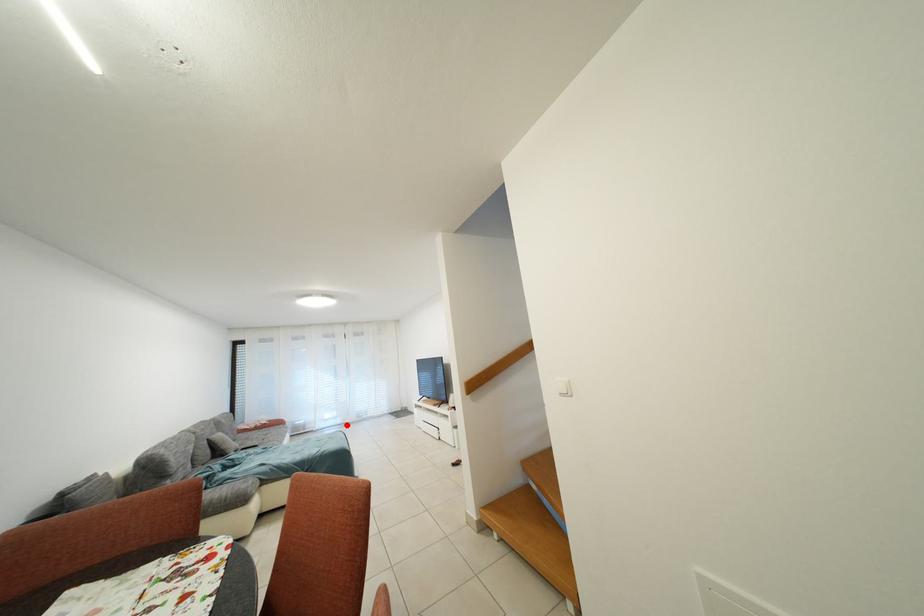
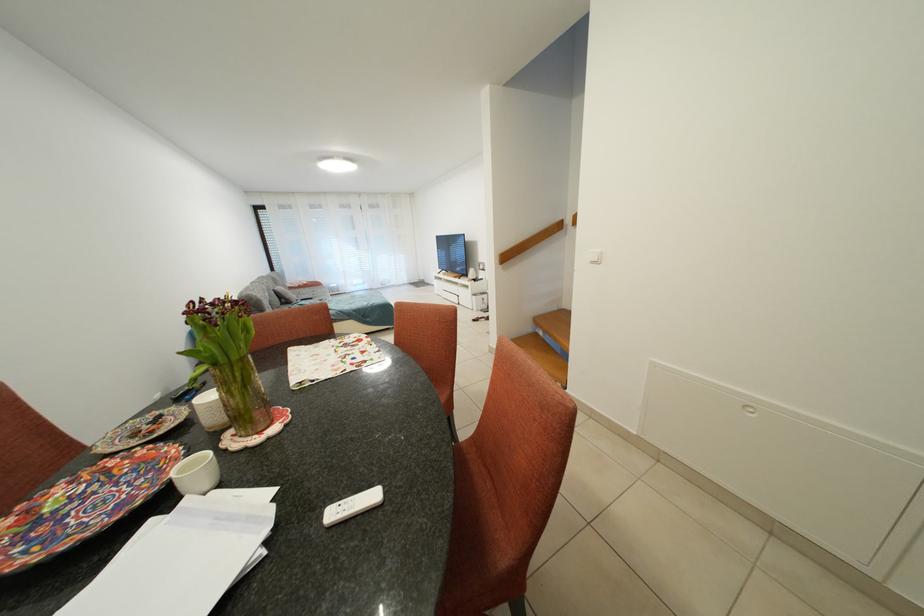
The point at the highlighted location is marked in the first image. Where is the corresponding point in the second image?

(373, 291)